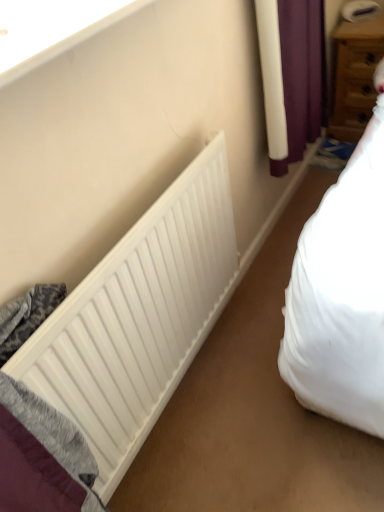
In order to face wooden drawer at upper right, should I rotate leftwards or rightwards?

Turn right approximately 22.163 degrees to face it.

This screenshot has width=384, height=512. I want to click on white smooth window sill at upper left, so click(x=51, y=29).

What do you see at coordinates (138, 318) in the screenshot? I see `white matte radiator at lower left` at bounding box center [138, 318].

Where is `wooden drawer at upper right`? Image resolution: width=384 pixels, height=512 pixels. wooden drawer at upper right is located at coordinates tap(355, 81).

Which is behind, point (360, 122) or point (74, 37)?

Point (360, 122)

Where is `window sill that is below the wooden drawer at upper right (from the image's perspective)`? window sill that is below the wooden drawer at upper right (from the image's perspective) is located at coordinates (51, 29).

Is wooden drawer at upper right completely or partially outside of white smooth window sill at upper left?

Yes.

How far apart are wooden drawer at upper right and white smooth window sill at upper left?

wooden drawer at upper right and white smooth window sill at upper left are 1.76 meters apart from each other.

Could you tell me if wooden drawer at upper right is turned towards white matte radiator at lower left?

Yes, wooden drawer at upper right is aimed at white matte radiator at lower left.

From the picture: Is the position of wooden drawer at upper right less distant than that of white matte radiator at lower left?

No, wooden drawer at upper right is behind white matte radiator at lower left.

From a real-world perspective, which is physically below, wooden drawer at upper right or white matte radiator at lower left?

From a 3D spatial view, wooden drawer at upper right is below.

Is point (340, 53) closer or farther from the camera than point (151, 244)?

Point (340, 53) is positioned farther from the camera compared to point (151, 244).

Is white matte radiator at lower left outside of white smooth window sill at upper left?

white matte radiator at lower left is positioned outside white smooth window sill at upper left.

Where is `window sill above the white matte radiator at lower left (from a real-world perspective)`? Image resolution: width=384 pixels, height=512 pixels. window sill above the white matte radiator at lower left (from a real-world perspective) is located at coordinates (51, 29).

Considering the sizes of white matte radiator at lower left and white smooth window sill at upper left in the image, is white matte radiator at lower left taller or shorter than white smooth window sill at upper left?

Clearly, white matte radiator at lower left is taller compared to white smooth window sill at upper left.

Considering the relative positions of white matte radiator at lower left and white smooth window sill at upper left in the image provided, is white matte radiator at lower left to the right of white smooth window sill at upper left from the viewer's perspective?

Yes, white matte radiator at lower left is to the right of white smooth window sill at upper left.

Looking at the image, does white smooth window sill at upper left seem bigger or smaller compared to white matte radiator at lower left?

In the image, white smooth window sill at upper left appears to be smaller than white matte radiator at lower left.

In the scene shown: From a real-world perspective, is white smooth window sill at upper left below white matte radiator at lower left?

No, from a real-world perspective, white smooth window sill at upper left is not under white matte radiator at lower left.

Between white smooth window sill at upper left and white matte radiator at lower left, which one has more height?

white matte radiator at lower left is taller.

From the image's perspective, does white smooth window sill at upper left appear lower than white matte radiator at lower left?

No.

In terms of size, does white matte radiator at lower left appear bigger or smaller than wooden drawer at upper right?

white matte radiator at lower left is smaller than wooden drawer at upper right.

Is white matte radiator at lower left to the right of wooden drawer at upper right from the viewer's perspective?

In fact, white matte radiator at lower left is to the left of wooden drawer at upper right.

Is white matte radiator at lower left facing away from wooden drawer at upper right?

No, white matte radiator at lower left is not facing away from wooden drawer at upper right.

Who is shorter, white matte radiator at lower left or wooden drawer at upper right?

wooden drawer at upper right.

Between white smooth window sill at upper left and wooden drawer at upper right, which one has smaller size?

With smaller size is white smooth window sill at upper left.

Is white smooth window sill at upper left looking in the opposite direction of wooden drawer at upper right?

No, white smooth window sill at upper left is not facing away from wooden drawer at upper right.

From the image's perspective, between white smooth window sill at upper left and wooden drawer at upper right, which one is located above?

wooden drawer at upper right is shown above in the image.

Is white smooth window sill at upper left in front of or behind wooden drawer at upper right in the image?

white smooth window sill at upper left is in front of wooden drawer at upper right.

Where is `window sill lying below the wooden drawer at upper right (from the image's perspective)`? Image resolution: width=384 pixels, height=512 pixels. window sill lying below the wooden drawer at upper right (from the image's perspective) is located at coordinates (51, 29).

Identify the location of drawer behind the white matte radiator at lower left. This screenshot has height=512, width=384. (355, 81).

From the image, which object appears to be farther from white matte radiator at lower left, white smooth window sill at upper left or wooden drawer at upper right?

wooden drawer at upper right is positioned further to the anchor white matte radiator at lower left.

Estimate the real-world distances between objects in this image. Which object is further from white matte radiator at lower left, wooden drawer at upper right or white smooth window sill at upper left?

wooden drawer at upper right.

Consider the image. Looking at the image, which one is located closer to white smooth window sill at upper left, wooden drawer at upper right or white matte radiator at lower left?

white matte radiator at lower left.

Estimate the real-world distances between objects in this image. Which object is closer to wooden drawer at upper right, white smooth window sill at upper left or white matte radiator at lower left?

white matte radiator at lower left.

Based on the photo, which object lies nearer to the anchor point white smooth window sill at upper left, white matte radiator at lower left or wooden drawer at upper right?

white matte radiator at lower left is positioned closer to the anchor white smooth window sill at upper left.

Estimate the real-world distances between objects in this image. Which object is further from wooden drawer at upper right, white matte radiator at lower left or white smooth window sill at upper left?

white smooth window sill at upper left is further to wooden drawer at upper right.

Find the location of `radiator between white smooth window sill at upper left and wooden drawer at upper right along the z-axis`. radiator between white smooth window sill at upper left and wooden drawer at upper right along the z-axis is located at coordinates pos(138,318).